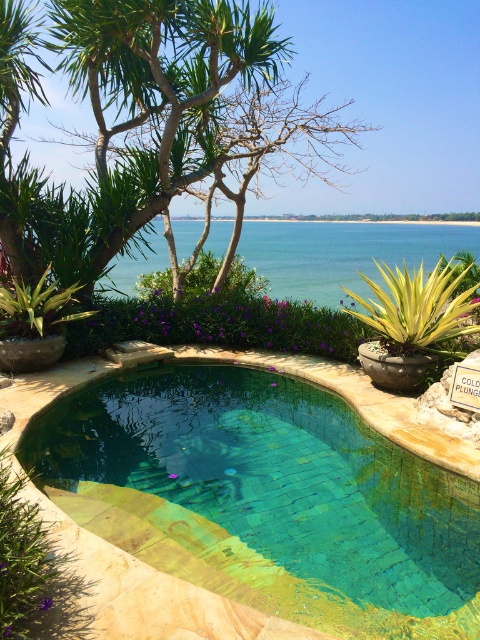
You are a lifeguard standing at the edge of the teal mosaic pool at center and clear blue water at center. You need to place a floating safety buoy in the middle of the pool. Which object should you use as a reference point to ensure the buoy is centered?

The teal mosaic pool at center is wider than the clear blue water at center, so you should use the teal mosaic pool at center as the reference point to ensure the buoy is centered.

You are a lifeguard standing at the edge of the teal mosaic pool at center and clear blue water at center. You need to jump into the water to rescue someone. Which object will you enter first?

You will enter the clear blue water at center first because the teal mosaic pool at center is much taller than the clear blue water at center, meaning the water is lower and closer to the edge where you are standing.